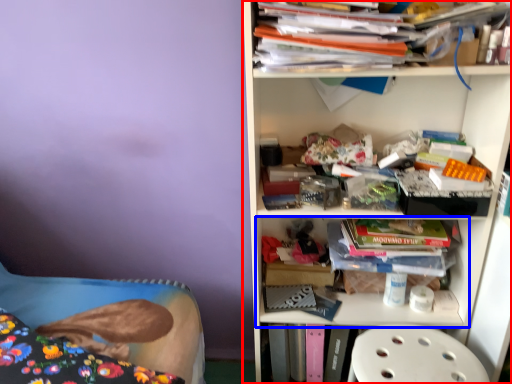
Question: Which of the following is the closest to the observer, shelf (highlighted by a red box) or shelf (highlighted by a blue box)?

Choices:
 (A) shelf
 (B) shelf

Answer: (A)